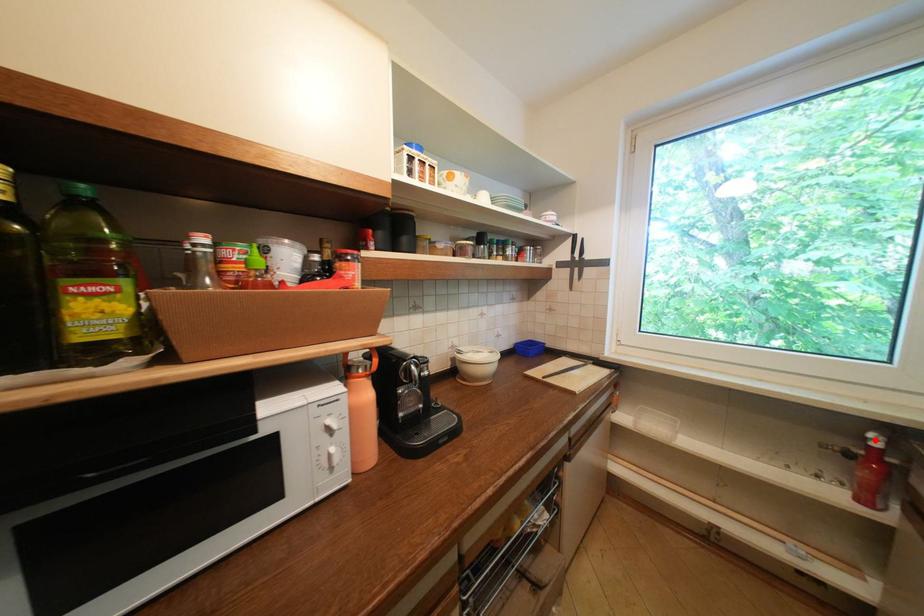
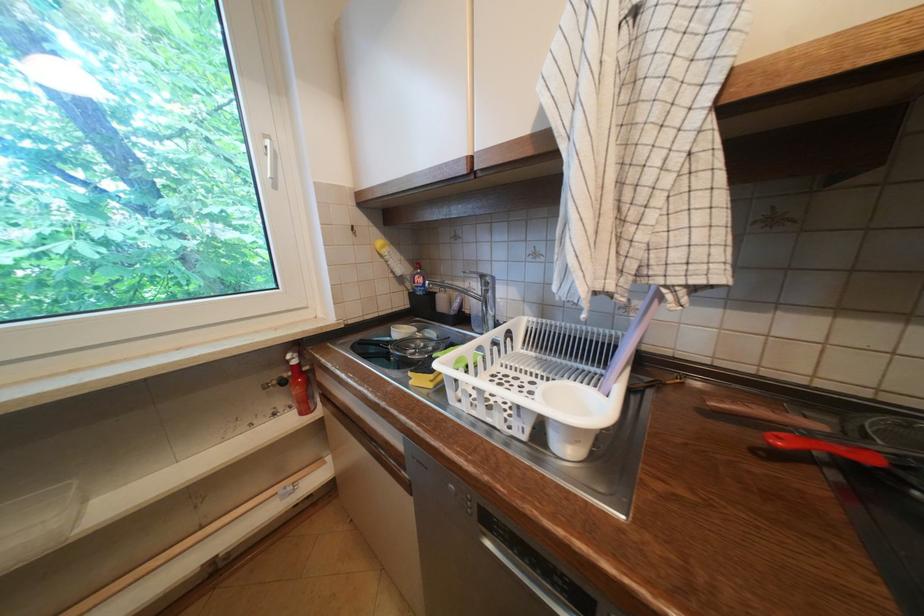
Find the pixel in the second image that matches the highlighted location in the first image.

(296, 362)